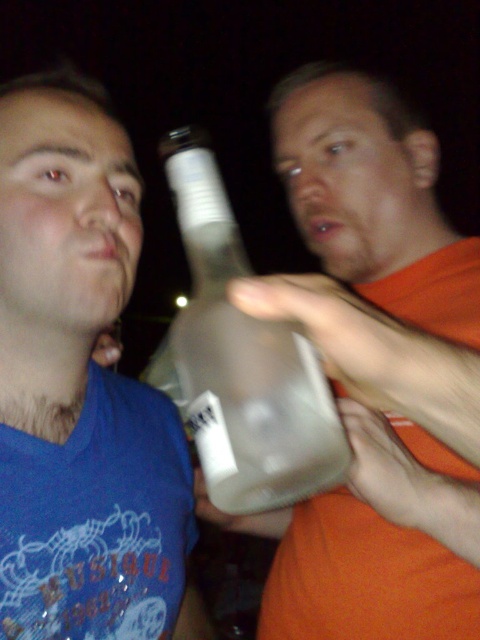
You are organizing a picnic and have two bottles to choose from. The translucent glass bottle at center and the matte plastic bottle at left. Which one has a bigger capacity?

The translucent glass bottle at center has a larger size compared to matte plastic bottle at left, so it has a bigger capacity.

You are a delivery person who needs to store both the translucent glass bottle at center and the transparent plastic bottle at center in a vertical storage compartment that can only accommodate items up to 15 cm in height. Given their heights, which bottle might not fit?

The translucent glass bottle at center is much taller than the transparent plastic bottle at center, so the translucent glass bottle at center might not fit in the 15 cm height storage compartment.

You are a photographer trying to capture both the matte plastic bottle at left and the transparent plastic bottle at center in a single frame. Based on their positions, which bottle should you focus on first to ensure both are in focus?

The matte plastic bottle at left is above the transparent plastic bottle at center. To ensure both are in focus, you should focus on the transparent plastic bottle at center first since it is closer to the camera, and the depth of field will naturally include the one further away.